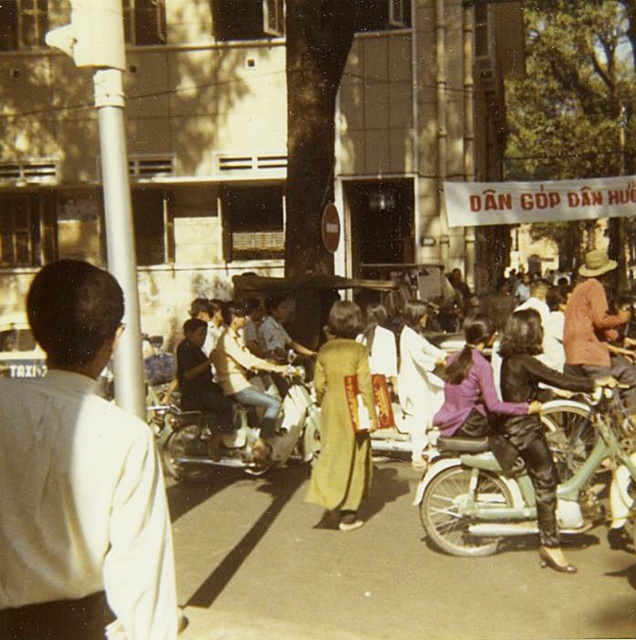
Does white shirt at left have a greater height compared to light green metallic motorcycle at center-right?

Incorrect, white shirt at left's height is not larger of light green metallic motorcycle at center-right's.

Is white shirt at left to the left of light green metallic motorcycle at center-right from the viewer's perspective?

Yes, white shirt at left is to the left of light green metallic motorcycle at center-right.

Who is more distant from viewer, (60, 525) or (584, 448)?

Positioned behind is point (584, 448).

Where is `white shirt at left`? white shirt at left is located at coordinates [80, 481].

Can you confirm if light green metallic motorcycle at center-right is taller than yellow silk ao dai at center?

In fact, light green metallic motorcycle at center-right may be shorter than yellow silk ao dai at center.

Measure the distance from light green metallic motorcycle at center-right to yellow silk ao dai at center.

light green metallic motorcycle at center-right is 1.38 meters from yellow silk ao dai at center.

Where is `light green metallic motorcycle at center-right`? This screenshot has height=640, width=636. light green metallic motorcycle at center-right is located at coordinates (473, 499).

Does white matte motorcycle at center lie in front of leather pants at center?

No, it is not.

Can you confirm if white matte motorcycle at center is positioned to the right of leather pants at center?

In fact, white matte motorcycle at center is to the left of leather pants at center.

At what (x,y) coordinates should I click in order to perform the action: click on white matte motorcycle at center. Please return your answer as a coordinate pair (x, y). This screenshot has height=640, width=636. Looking at the image, I should click on 240,432.